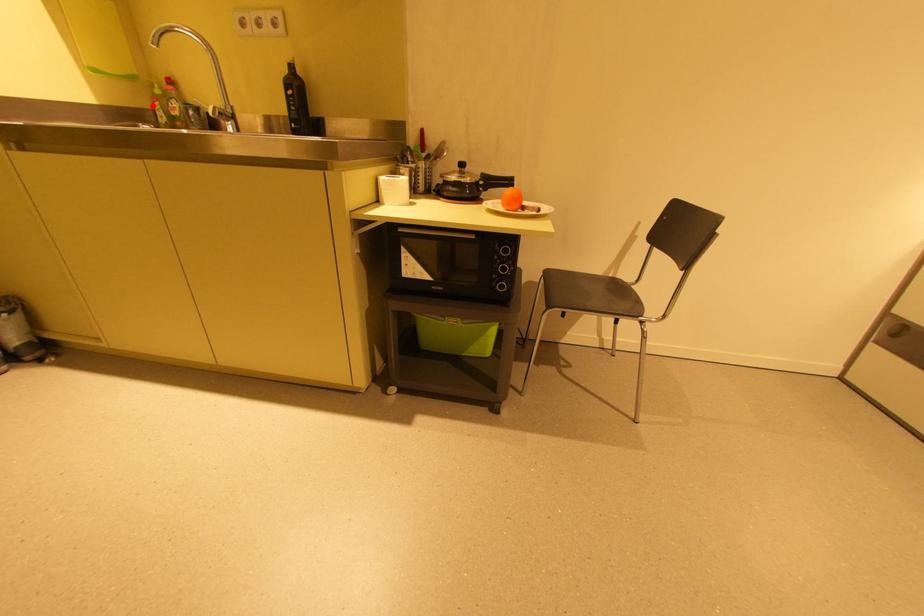
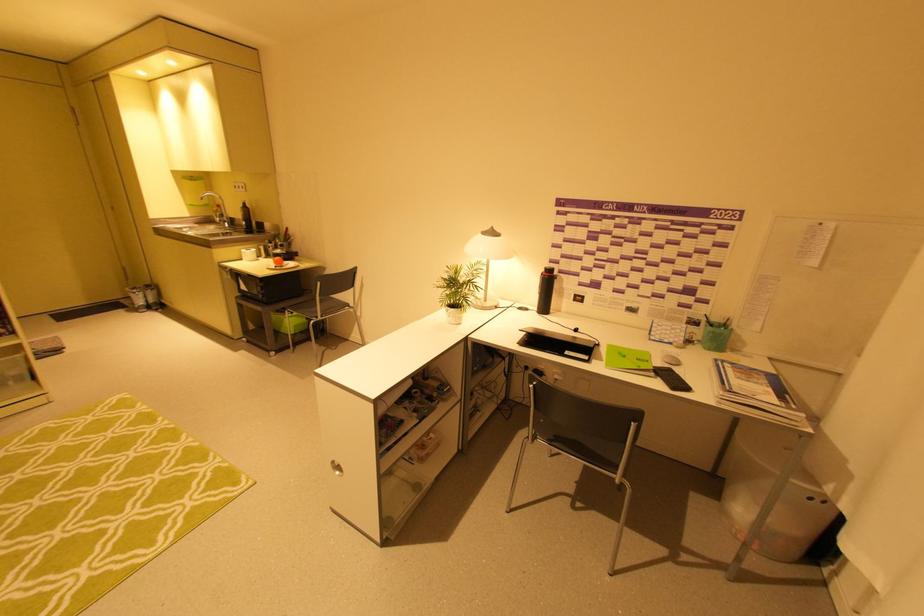
Question: I am providing you with two images of the same scene from different viewpoints. A red point is shown in image1. For the corresponding object point in image2, is it positioned nearer or farther from the camera?

Choices:
 (A) Nearer
 (B) Farther

Answer: (A)